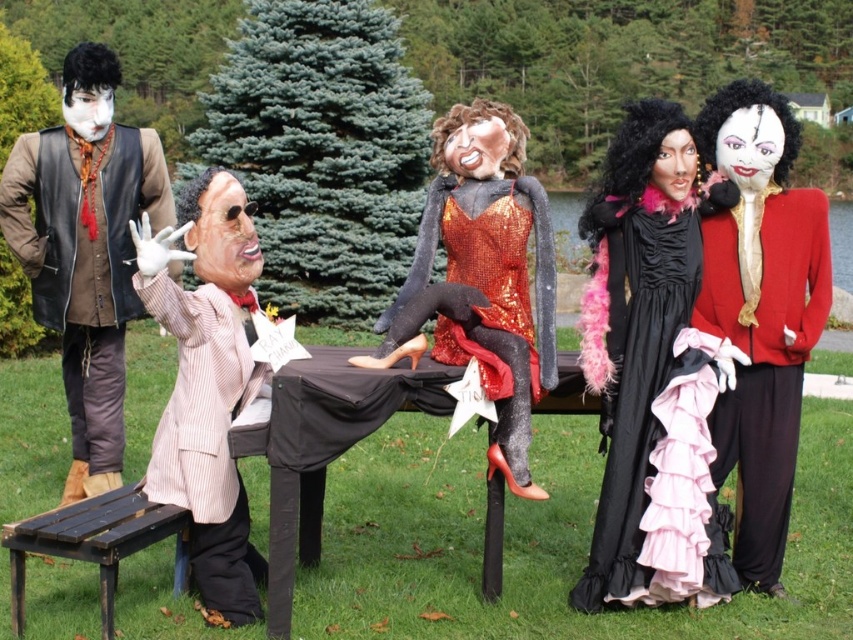
Question: Which of the following is the closest to the observer?

Choices:
 (A) (68, 172)
 (B) (198, 586)
 (C) (102, 564)

Answer: (C)

Question: Which object appears closest to the camera in this image?

Choices:
 (A) pink striped suit at center
 (B) leather vest at left

Answer: (A)

Question: Considering the real-world distances, which object is farthest from the wooden park bench at lower left?

Choices:
 (A) velvet red coat at right
 (B) black satin dress at center
 (C) leather vest at left
 (D) pink striped suit at center

Answer: (A)

Question: Can you confirm if shiny sequined dress at center is positioned to the left of wooden park bench at lower left?

Choices:
 (A) yes
 (B) no

Answer: (B)

Question: Can you confirm if leather vest at left is positioned below wooden park bench at lower left?

Choices:
 (A) no
 (B) yes

Answer: (A)

Question: Can you confirm if leather vest at left is positioned above pink striped suit at center?

Choices:
 (A) no
 (B) yes

Answer: (B)